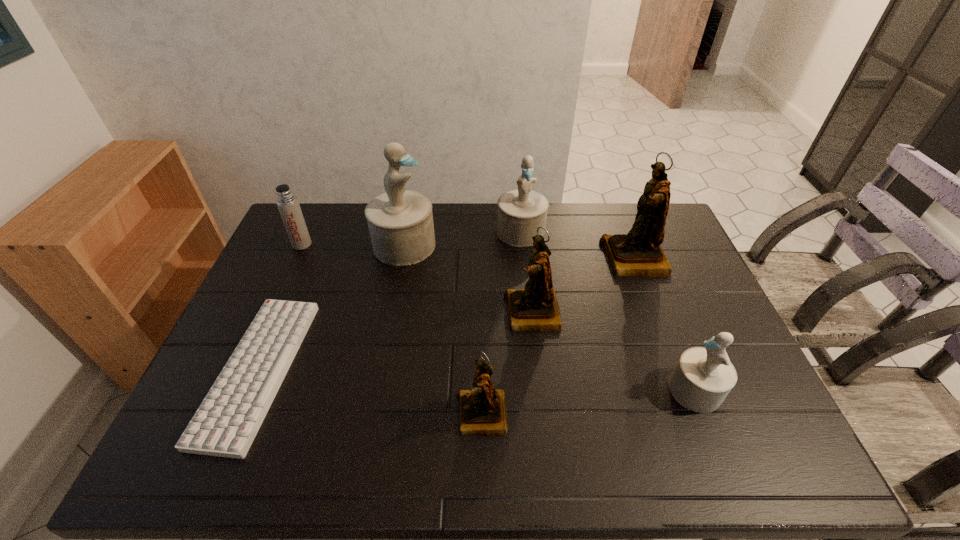
Where is `vacant space at the right edge`? vacant space at the right edge is located at coordinates (699, 327).

The height and width of the screenshot is (540, 960). I want to click on vacant region between the second gold figurine from left to right and the computer keyboard, so click(396, 341).

The height and width of the screenshot is (540, 960). Identify the location of vacant area that lies between the farthest gold figurine and the computer keyboard. (446, 314).

Find the location of `free space that is in between the nearest gold figurine and the shortest object`. free space that is in between the nearest gold figurine and the shortest object is located at coordinates pyautogui.click(x=370, y=393).

Where is `empty location between the sixth object from right to left and the shortest object`? empty location between the sixth object from right to left and the shortest object is located at coordinates (331, 307).

This screenshot has width=960, height=540. What are the coordinates of `empty space between the leftmost figurine and the second farthest gold figurine` in the screenshot? It's located at (468, 279).

Locate an element on the screen. This screenshot has height=540, width=960. vacant area that lies between the computer keyboard and the second smallest white figurine is located at coordinates (390, 301).

At what (x,y) coordinates should I click in order to perform the action: click on vacant space that is in between the smallest gold figurine and the computer keyboard. Please return your answer as a coordinate pair (x, y). Looking at the image, I should click on (370, 393).

In order to click on free space between the fourth farthest figurine and the second smallest white figurine in this screenshot , I will do `click(526, 272)`.

The image size is (960, 540). What are the coordinates of `vacant area that lies between the nearest white figurine and the second smallest white figurine` in the screenshot? It's located at (608, 310).